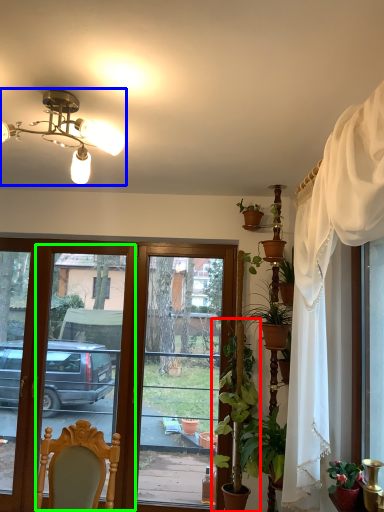
Question: Estimate the real-world distances between objects in this image. Which object is farther from houseplant (highlighted by a red box), lamp (highlighted by a blue box) or screen door (highlighted by a green box)?

Choices:
 (A) lamp
 (B) screen door

Answer: (B)